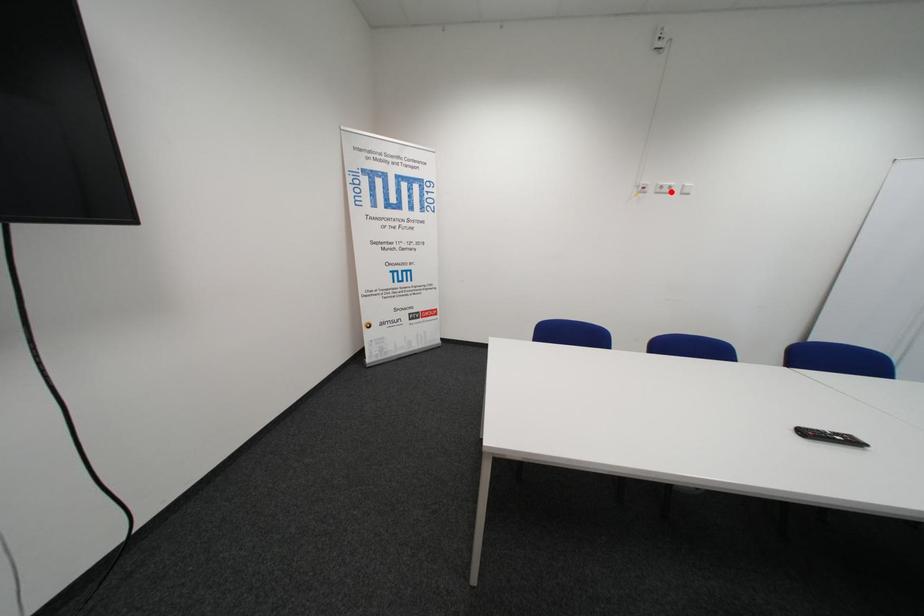
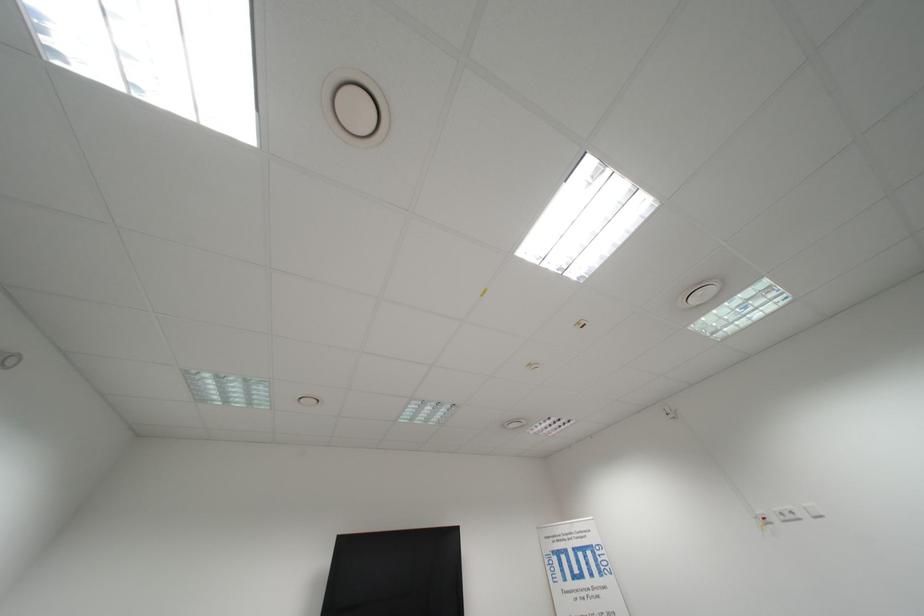
The point at the highlighted location is marked in the first image. Where is the corresponding point in the second image?

(796, 519)